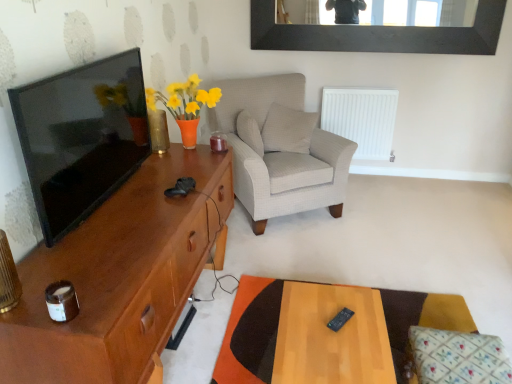
At what (x,y) coordinates should I click in order to perform the action: click on free spot above wooden rectangular table at center (from a real-world perspective). Please return your answer as a coordinate pair (x, y). This screenshot has height=384, width=512. Looking at the image, I should click on (340, 325).